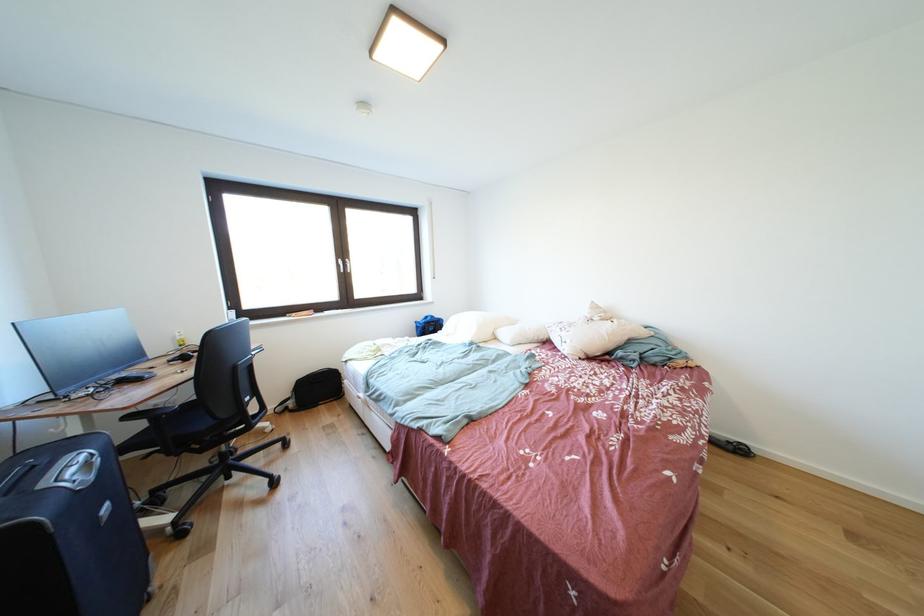
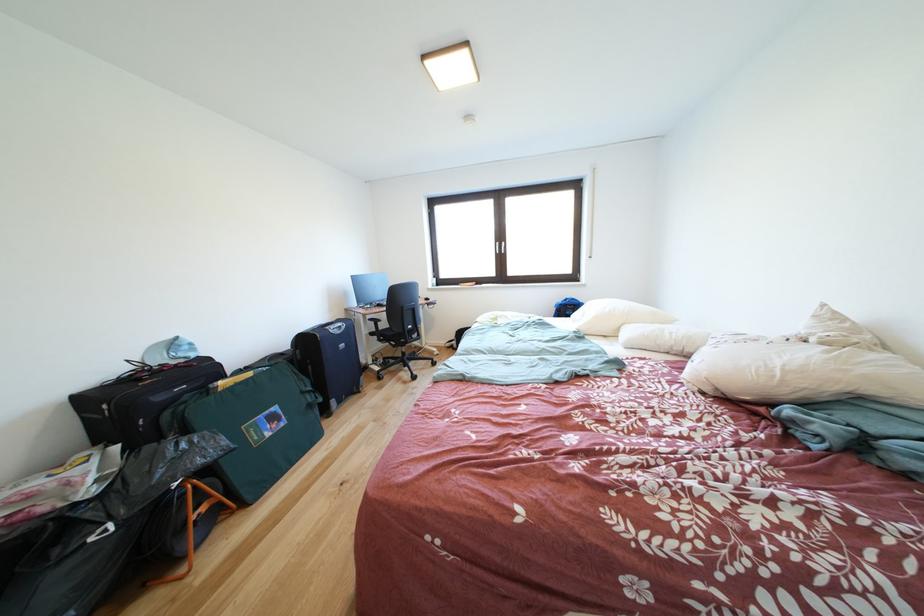
Locate, in the second image, the point that corresponds to (x=590, y=361) in the first image.

(716, 394)